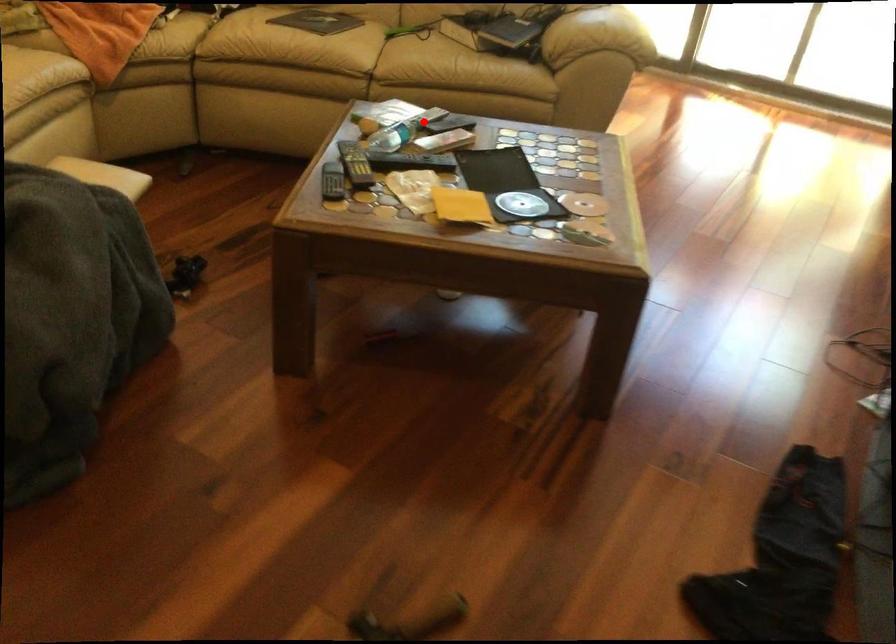
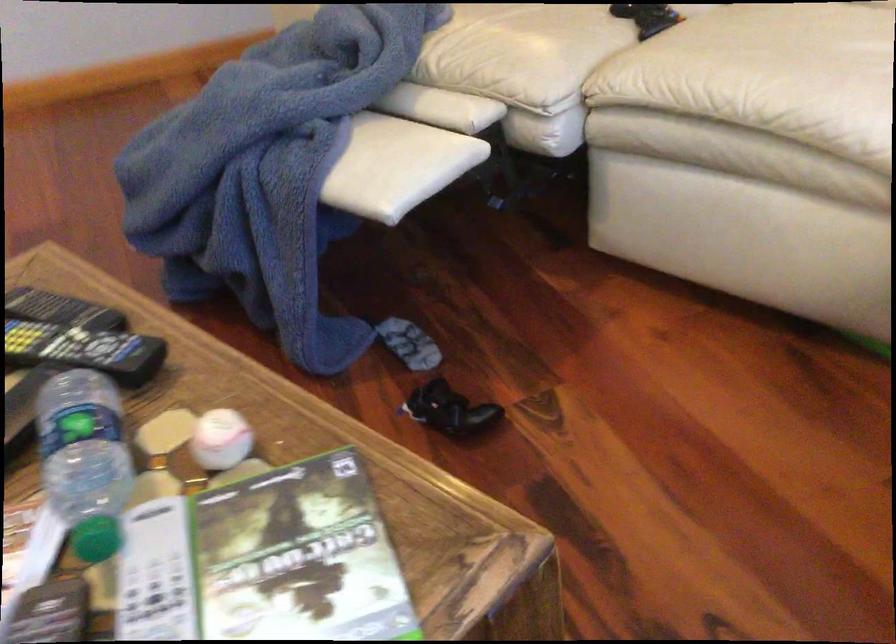
The point at the highlighted location is marked in the first image. Where is the corresponding point in the second image?

(156, 574)